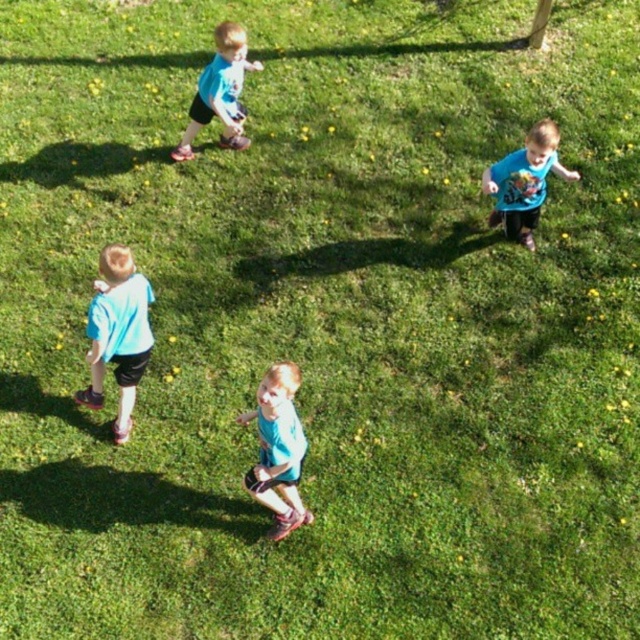
Question: Is blue matte shorts at center behind blue matte shirt at upper right?

Choices:
 (A) yes
 (B) no

Answer: (B)

Question: Which point appears closest to the camera in this image?

Choices:
 (A) (522, 234)
 (B) (308, 518)

Answer: (B)

Question: Can you confirm if blue matte shirt at lower left is positioned below matte blue shirt at upper left?

Choices:
 (A) no
 (B) yes

Answer: (B)

Question: Which object is positioned closest to the blue matte shirt at lower left?

Choices:
 (A) blue matte shorts at center
 (B) matte blue shirt at upper left
 (C) blue matte shirt at upper right

Answer: (A)

Question: Which of the following is the closest to the observer?

Choices:
 (A) blue matte shirt at lower left
 (B) blue matte shorts at center

Answer: (B)

Question: Is blue matte shorts at center bigger than blue matte shirt at upper right?

Choices:
 (A) yes
 (B) no

Answer: (B)